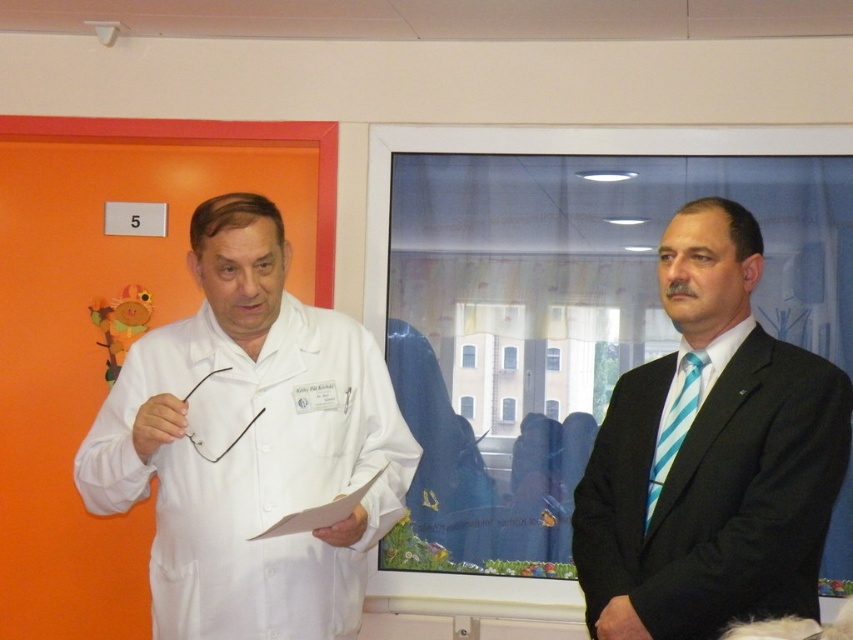
Who is positioned more to the left, white matte lab coat at left or teal striped tie at right?

From the viewer's perspective, white matte lab coat at left appears more on the left side.

Between white matte lab coat at left and teal striped tie at right, which one has less height?

Standing shorter between the two is teal striped tie at right.

Is point (339, 387) more distant than point (688, 397)?

Yes, point (339, 387) is behind point (688, 397).

Image resolution: width=853 pixels, height=640 pixels. I want to click on white matte lab coat at left, so click(250, 444).

Does matte white coat at center have a greater width compared to teal striped tie at right?

Yes.

Which is above, matte white coat at center or teal striped tie at right?

Positioned higher is matte white coat at center.

Is point (785, 524) positioned before point (659, 452)?

That is True.

Identify the location of matte white coat at center. (711, 456).

The image size is (853, 640). I want to click on white matte lab coat at left, so click(250, 444).

Is white matte lab coat at left shorter than matte white coat at center?

Incorrect, white matte lab coat at left's height does not fall short of matte white coat at center's.

What do you see at coordinates (250, 444) in the screenshot? I see `white matte lab coat at left` at bounding box center [250, 444].

The height and width of the screenshot is (640, 853). I want to click on white matte lab coat at left, so click(x=250, y=444).